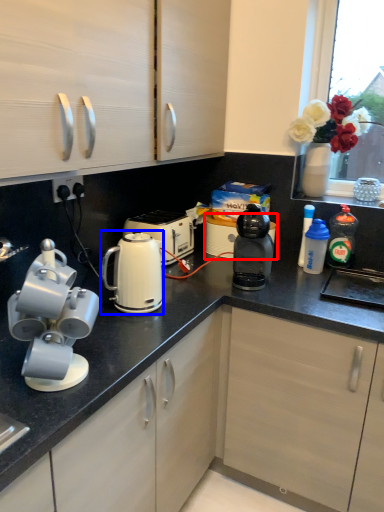
Question: Which of the following is the farthest to the observer, appliance (highlighted by a red box) or kitchen appliance (highlighted by a blue box)?

Choices:
 (A) appliance
 (B) kitchen appliance

Answer: (A)